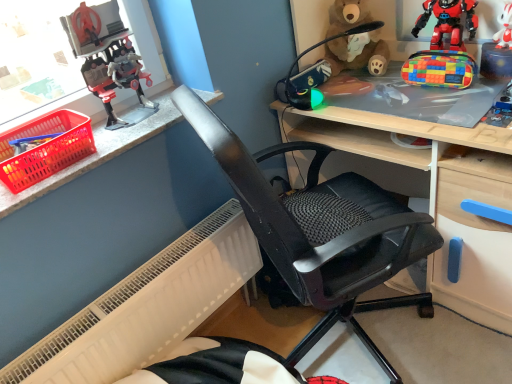
In the scene shown: In order to face multicolored plastic toy at upper right, arranged as the second toy when viewed from the right, should I rotate leftwards or rightwards?

To align with it, rotate right about 24.172°.

The image size is (512, 384). I want to click on multicolored plastic toy at upper right, arranged as the second toy when viewed from the right, so click(448, 22).

What is the approximate width of multicolored fabric pencil case at upper right, which appears as the 3th toy when viewed from the right?

multicolored fabric pencil case at upper right, which appears as the 3th toy when viewed from the right, is 4.09 inches wide.

What do you see at coordinates (357, 54) in the screenshot? The height and width of the screenshot is (384, 512). I see `brown plush bear at upper center` at bounding box center [357, 54].

The image size is (512, 384). What do you see at coordinates (45, 148) in the screenshot?
I see `translucent plastic basket at left` at bounding box center [45, 148].

Locate an element on the screen. This screenshot has width=512, height=384. multicolored plastic toy at upper right, arranged as the second toy when viewed from the right is located at coordinates (448, 22).

Is white matte plush toy at upper right, the 1th toy in the right-to-left sequence, situated inside smooth stone counter top at upper left or outside?

white matte plush toy at upper right, the 1th toy in the right-to-left sequence, lies outside smooth stone counter top at upper left.

In the scene shown: Considering the relative positions of white matte plush toy at upper right, which appears as the fifth toy when viewed from the left, and smooth stone counter top at upper left in the image provided, is white matte plush toy at upper right, which appears as the fifth toy when viewed from the left, to the left or to the right of smooth stone counter top at upper left?

In the image, white matte plush toy at upper right, which appears as the fifth toy when viewed from the left, appears on the right side of smooth stone counter top at upper left.

From the image's perspective, which one is positioned higher, white matte plush toy at upper right, which appears as the fifth toy when viewed from the left, or smooth stone counter top at upper left?

white matte plush toy at upper right, which appears as the fifth toy when viewed from the left, from the image's perspective.

Is white matte plush toy at upper right, which appears as the fifth toy when viewed from the left, oriented towards smooth stone counter top at upper left?

No, white matte plush toy at upper right, which appears as the fifth toy when viewed from the left, is not oriented towards smooth stone counter top at upper left.

Is translucent plastic basket at left wider or thinner than multicolored fabric pencil case at upper right, which appears as the 3th toy when viewed from the right?

translucent plastic basket at left is wider than multicolored fabric pencil case at upper right, which appears as the 3th toy when viewed from the right.

Looking at this image, how much distance is there between translucent plastic basket at left and multicolored fabric pencil case at upper right, which is the 3th toy from left to right?

translucent plastic basket at left and multicolored fabric pencil case at upper right, which is the 3th toy from left to right, are 3.74 feet apart.

From the image's perspective, relative to multicolored fabric pencil case at upper right, which is the 3th toy from left to right, is translucent plastic basket at left above or below?

translucent plastic basket at left is below multicolored fabric pencil case at upper right, which is the 3th toy from left to right.

Between translucent plastic basket at left and multicolored fabric pencil case at upper right, which appears as the 3th toy when viewed from the right, which one appears on the left side from the viewer's perspective?

translucent plastic basket at left.

Which object is closer to the camera taking this photo, multicolored fabric pencil case at upper right, which is the 3th toy from left to right, or white plastic radiator at lower left?

white plastic radiator at lower left.

This screenshot has width=512, height=384. What are the coordinates of `radiator below the multicolored fabric pencil case at upper right, which appears as the 3th toy when viewed from the right (from a real-world perspective)` in the screenshot? It's located at (147, 307).

Considering the relative positions of multicolored fabric pencil case at upper right, which appears as the 3th toy when viewed from the right, and white plastic radiator at lower left in the image provided, is multicolored fabric pencil case at upper right, which appears as the 3th toy when viewed from the right, to the right of white plastic radiator at lower left from the viewer's perspective?

Correct, you'll find multicolored fabric pencil case at upper right, which appears as the 3th toy when viewed from the right, to the right of white plastic radiator at lower left.

Considering the sizes of objects multicolored fabric pencil case at upper right, which is the 3th toy from left to right, and white plastic radiator at lower left in the image provided, who is taller, multicolored fabric pencil case at upper right, which is the 3th toy from left to right, or white plastic radiator at lower left?

white plastic radiator at lower left is taller.

Identify the location of radiator that appears below the translucent plastic basket at left (from a real-world perspective). This screenshot has height=384, width=512. (147, 307).

Is translucent plastic basket at left aimed at white plastic radiator at lower left?

No, translucent plastic basket at left is not aimed at white plastic radiator at lower left.

Measure the distance between translucent plastic basket at left and white plastic radiator at lower left.

The distance of translucent plastic basket at left from white plastic radiator at lower left is 50.83 centimeters.

Is translucent plastic basket at left taller than white plastic radiator at lower left?

In fact, translucent plastic basket at left may be shorter than white plastic radiator at lower left.

Locate an element on the screen. toy that is the 1st object located below the brown plush bear at upper center (from the image's perspective) is located at coordinates (448, 22).

Is multicolored plastic toy at upper right, placed as the fourth toy when sorted from left to right, not within brown plush bear at upper center?

Absolutely, multicolored plastic toy at upper right, placed as the fourth toy when sorted from left to right, is external to brown plush bear at upper center.

Is the surface of multicolored plastic toy at upper right, placed as the fourth toy when sorted from left to right, in direct contact with brown plush bear at upper center?

multicolored plastic toy at upper right, placed as the fourth toy when sorted from left to right, and brown plush bear at upper center are not in contact.

How far apart are multicolored plastic toy at upper right, arranged as the second toy when viewed from the right, and brown plush bear at upper center?

multicolored plastic toy at upper right, arranged as the second toy when viewed from the right, and brown plush bear at upper center are 9.02 inches apart from each other.

Relative to wooden desk at center, is brown plush toy at upper right, placed as the second toy when sorted from left to right, in front or behind?

brown plush toy at upper right, placed as the second toy when sorted from left to right, is behind wooden desk at center.

Is brown plush toy at upper right, the fourth toy viewed from the right, turned away from wooden desk at center?

Yes, wooden desk at center is at the back of brown plush toy at upper right, the fourth toy viewed from the right.

Can you confirm if brown plush toy at upper right, placed as the second toy when sorted from left to right, is taller than wooden desk at center?

Incorrect, the height of brown plush toy at upper right, placed as the second toy when sorted from left to right, is not larger of that of wooden desk at center.

Looking at their sizes, would you say brown plush toy at upper right, the fourth toy viewed from the right, is wider or thinner than white matte plush toy at upper right, which appears as the fifth toy when viewed from the left?

Considering their sizes, brown plush toy at upper right, the fourth toy viewed from the right, looks broader than white matte plush toy at upper right, which appears as the fifth toy when viewed from the left.

How many degrees apart are the facing directions of brown plush toy at upper right, the fourth toy viewed from the right, and white matte plush toy at upper right, the 1th toy in the right-to-left sequence?

The angular difference between brown plush toy at upper right, the fourth toy viewed from the right, and white matte plush toy at upper right, the 1th toy in the right-to-left sequence, is 83 degrees.

From a real-world perspective, between brown plush toy at upper right, placed as the second toy when sorted from left to right, and white matte plush toy at upper right, which appears as the fifth toy when viewed from the left, who is vertically higher?

white matte plush toy at upper right, which appears as the fifth toy when viewed from the left, from a real-world perspective.

Which object is more forward, brown plush toy at upper right, placed as the second toy when sorted from left to right, or white matte plush toy at upper right, which appears as the fifth toy when viewed from the left?

Positioned in front is white matte plush toy at upper right, which appears as the fifth toy when viewed from the left.

In the image, there is a white matte plush toy at upper right, the 1th toy in the right-to-left sequence. Identify the location of counter top below it (from a real-world perspective). coord(97,153).

You are a GUI agent. You are given a task and a screenshot of the screen. Output one action in this format:
    pyautogui.click(x=<x>, y=<y>)
    Task: Click on the basket above the multicolored fabric pencil case at upper right, which appears as the 3th toy when viewed from the right (from a real-world perspective)
    This screenshot has height=384, width=512.
    Given the screenshot: What is the action you would take?
    pyautogui.click(x=45, y=148)

From the picture: Estimate the real-world distances between objects in this image. Which object is further from multicolored plastic toy at upper right, arranged as the second toy when viewed from the right, brown plush toy at upper right, placed as the second toy when sorted from left to right, or translucent plastic basket at left?

translucent plastic basket at left.

Based on their spatial positions, is translucent plastic basket at left or multicolored fabric pencil case at upper right, which appears as the 3th toy when viewed from the right, further from brown plush toy at upper right, the fourth toy viewed from the right?

The object further to brown plush toy at upper right, the fourth toy viewed from the right, is translucent plastic basket at left.

Which object lies nearer to the anchor point plastic robot at upper left, the first toy from the left, black mesh office chair at center or brown plush toy at upper right, the fourth toy viewed from the right?

The object closer to plastic robot at upper left, the first toy from the left, is black mesh office chair at center.

Considering their positions, is wooden desk at center positioned closer to translucent plastic basket at left than brown plush toy at upper right, placed as the second toy when sorted from left to right?

The object closer to translucent plastic basket at left is brown plush toy at upper right, placed as the second toy when sorted from left to right.

Based on their spatial positions, is multicolored fabric pencil case at upper right, which is the 3th toy from left to right, or brown plush toy at upper right, the fourth toy viewed from the right, further from black mesh office chair at center?

multicolored fabric pencil case at upper right, which is the 3th toy from left to right, lies further to black mesh office chair at center than the other object.

In the scene shown: Looking at the image, which one is located closer to smooth stone counter top at upper left, multicolored fabric pencil case at upper right, which appears as the 3th toy when viewed from the right, or plastic robot at upper left, which is the fifth toy in right-to-left order?

Among the two, plastic robot at upper left, which is the fifth toy in right-to-left order, is located nearer to smooth stone counter top at upper left.

From the image, which object appears to be farther from brown plush bear at upper center, smooth stone counter top at upper left or black mesh office chair at center?

smooth stone counter top at upper left is further to brown plush bear at upper center.

From the image, which object appears to be nearer to plastic robot at upper left, which is the fifth toy in right-to-left order, translucent plastic basket at left or smooth stone counter top at upper left?

smooth stone counter top at upper left.

In order to click on toy located between white plastic radiator at lower left and wooden desk at center in the left-right direction in this screenshot , I will do `click(314, 73)`.

At what (x,y) coordinates should I click in order to perform the action: click on chair between brown plush bear at upper center and white plastic radiator at lower left in the vertical direction. Please return your answer as a coordinate pair (x, y). This screenshot has width=512, height=384. Looking at the image, I should click on (321, 229).

This screenshot has width=512, height=384. What are the coordinates of `toy between smooth stone counter top at upper left and black mesh office chair at center` in the screenshot? It's located at (108, 59).

Where is `counter top between brown plush toy at upper right, the fourth toy viewed from the right, and white plastic radiator at lower left in the up-down direction`? This screenshot has width=512, height=384. counter top between brown plush toy at upper right, the fourth toy viewed from the right, and white plastic radiator at lower left in the up-down direction is located at coordinates (97, 153).